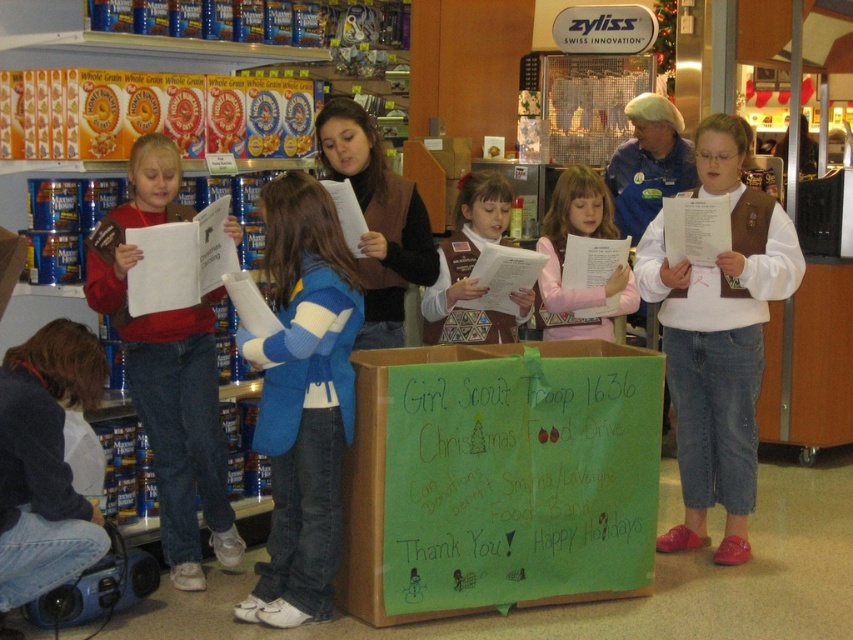
Between blue fleece vest at center and matte brown vest at left, which one has less height?

Standing shorter between the two is blue fleece vest at center.

Does point (294, 305) come in front of point (183, 532)?

Yes, it is.

Find the location of a particular element. The image size is (853, 640). blue fleece vest at center is located at coordinates (302, 397).

Locate an element on the screen. blue fleece vest at center is located at coordinates (302, 397).

Is blue fleece vest at center to the left of brown uniform vest at center from the viewer's perspective?

Yes, blue fleece vest at center is to the left of brown uniform vest at center.

Find the location of a particular element. blue fleece vest at center is located at coordinates (302, 397).

Is point (283, 561) positioned in front of point (468, 275)?

Yes, it is.

You are a GUI agent. You are given a task and a screenshot of the screen. Output one action in this format:
    pyautogui.click(x=<x>, y=<y>)
    Task: Click on the blue fleece vest at center
    This screenshot has width=853, height=640.
    Given the screenshot: What is the action you would take?
    pyautogui.click(x=302, y=397)

Is green cardboard box at center further to the viewer compared to matte brown vest at left?

No, it is in front of matte brown vest at left.

Who is more forward, (590,397) or (189,328)?

Point (590,397) is more forward.

Find the location of a particular element. The width and height of the screenshot is (853, 640). green cardboard box at center is located at coordinates (498, 477).